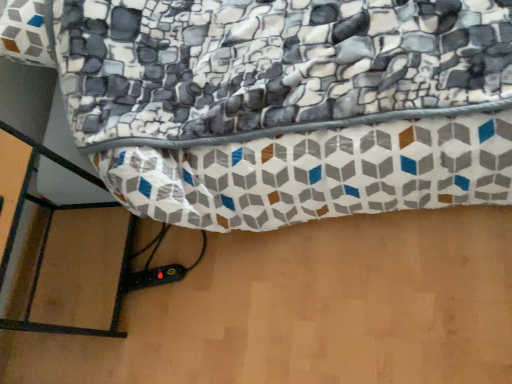
I want to click on textured fabric bag at center, so click(x=280, y=103).

Describe the element at coordinates (280, 103) in the screenshot. I see `textured fabric bag at center` at that location.

In order to click on textured fabric bag at center in this screenshot , I will do `click(280, 103)`.